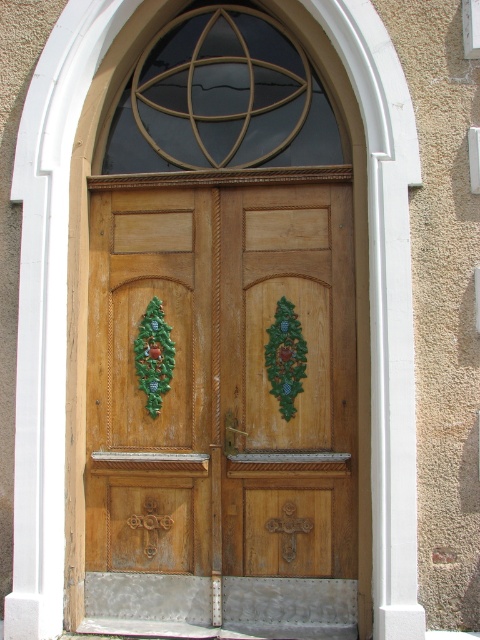
Can you confirm if green textured wreath at center is positioned to the right of green carved wreath at center?

Correct, you'll find green textured wreath at center to the right of green carved wreath at center.

Is green textured wreath at center taller than green carved wreath at center?

Yes.

Between point (292, 324) and point (159, 376), which one is positioned in front?

Point (292, 324)

I want to click on green textured wreath at center, so click(x=286, y=356).

The width and height of the screenshot is (480, 640). What do you see at coordinates (225, 380) in the screenshot?
I see `wooden door at center` at bounding box center [225, 380].

Which is below, wooden door at center or green textured wreath at center?

A: wooden door at center is below.

What do you see at coordinates (225, 380) in the screenshot? The height and width of the screenshot is (640, 480). I see `wooden door at center` at bounding box center [225, 380].

Image resolution: width=480 pixels, height=640 pixels. I want to click on wooden door at center, so click(225, 380).

Is point (111, 243) closer to camera compared to point (141, 385)?

That is False.

Locate an element on the screen. This screenshot has width=480, height=640. wooden door at center is located at coordinates (225, 380).

Which is behind, point (332, 289) or point (156, 358)?

Point (156, 358)

Where is `wooden door at center`? wooden door at center is located at coordinates click(x=225, y=380).